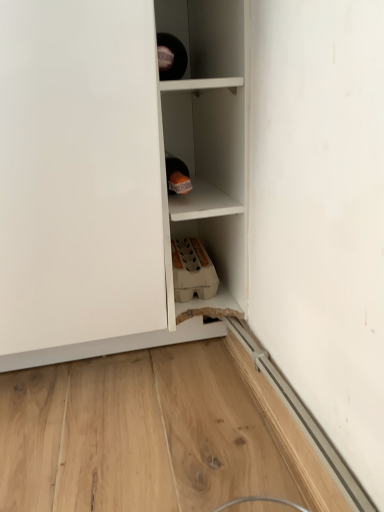
The height and width of the screenshot is (512, 384). What are the coordinates of `white matte cabinet at center` in the screenshot? It's located at (208, 139).

What do you see at coordinates (208, 139) in the screenshot? I see `white matte cabinet at center` at bounding box center [208, 139].

Describe the element at coordinates (117, 175) in the screenshot. I see `white matte cupboard at center` at that location.

Where is `white matte cupboard at center`? Image resolution: width=384 pixels, height=512 pixels. white matte cupboard at center is located at coordinates (117, 175).

Find the location of `white matte cabinet at center`. white matte cabinet at center is located at coordinates (208, 139).

Does white matte cupboard at center appear on the left side of white matte cabinet at center?

Correct, you'll find white matte cupboard at center to the left of white matte cabinet at center.

Which is in front, white matte cupboard at center or white matte cabinet at center?

white matte cupboard at center is closer to the camera.

Considering the positions of points (197, 24) and (184, 318), is point (197, 24) farther from camera compared to point (184, 318)?

Yes, it is.

From the image's perspective, relative to white matte cabinet at center, is white matte cupboard at center above or below?

Clearly, from the image's perspective, white matte cupboard at center is below white matte cabinet at center.

From a real-world perspective, is white matte cupboard at center located beneath white matte cabinet at center?

No, from a real-world perspective, white matte cupboard at center is not beneath white matte cabinet at center.

Is white matte cupboard at center wider than white matte cabinet at center?

Yes.

Considering the sizes of white matte cupboard at center and white matte cabinet at center in the image, is white matte cupboard at center taller or shorter than white matte cabinet at center?

In the image, white matte cupboard at center appears to be shorter than white matte cabinet at center.

Can you confirm if white matte cupboard at center is bigger than white matte cabinet at center?

Yes.

Is white matte cupboard at center outside of white matte cabinet at center?

Yes, white matte cupboard at center is outside of white matte cabinet at center.

Is white matte cupboard at center with white matte cabinet at center?

Yes, white matte cupboard at center is in contact with white matte cabinet at center.

Could you tell me if white matte cupboard at center is facing white matte cabinet at center?

No, white matte cupboard at center is not aimed at white matte cabinet at center.

Measure the distance between white matte cupboard at center and white matte cabinet at center.

They are 1.91 inches apart.

In order to click on cupboard above the white matte cabinet at center (from a real-world perspective) in this screenshot , I will do `click(117, 175)`.

Can you confirm if white matte cabinet at center is positioned to the left of white matte cupboard at center?

No.

Looking at this image, is the depth of white matte cabinet at center greater than that of white matte cupboard at center?

That is True.

Between point (176, 317) and point (86, 29), which one is positioned in front?

The point (86, 29) is in front.

From the image's perspective, which one is positioned higher, white matte cabinet at center or white matte cupboard at center?

white matte cabinet at center is shown above in the image.

From a real-world perspective, relative to white matte cupboard at center, is white matte cabinet at center vertically above or below?

Clearly, from a real-world perspective, white matte cabinet at center is below white matte cupboard at center.

Between white matte cabinet at center and white matte cupboard at center, which one has smaller width?

white matte cabinet at center.

Considering the sizes of objects white matte cabinet at center and white matte cupboard at center in the image provided, who is shorter, white matte cabinet at center or white matte cupboard at center?

Standing shorter between the two is white matte cupboard at center.

Can you confirm if white matte cabinet at center is bigger than white matte cupboard at center?

Incorrect, white matte cabinet at center is not larger than white matte cupboard at center.

Is white matte cupboard at center inside white matte cabinet at center?

No.

Is white matte cabinet at center far from white matte cupboard at center?

white matte cabinet at center is near white matte cupboard at center, not far away.

From the picture: Is white matte cabinet at center aimed at white matte cupboard at center?

No, white matte cabinet at center is not aimed at white matte cupboard at center.

Measure the distance from white matte cabinet at center to white matte cupboard at center.

The distance of white matte cabinet at center from white matte cupboard at center is 1.91 inches.

Where is `cupboard in front of the white matte cabinet at center`? This screenshot has height=512, width=384. cupboard in front of the white matte cabinet at center is located at coordinates (117, 175).

The image size is (384, 512). I want to click on cabinetry lying above the white matte cupboard at center (from the image's perspective), so click(208, 139).

Where is `cabinetry below the white matte cupboard at center (from a real-world perspective)`? The width and height of the screenshot is (384, 512). cabinetry below the white matte cupboard at center (from a real-world perspective) is located at coordinates coord(208,139).